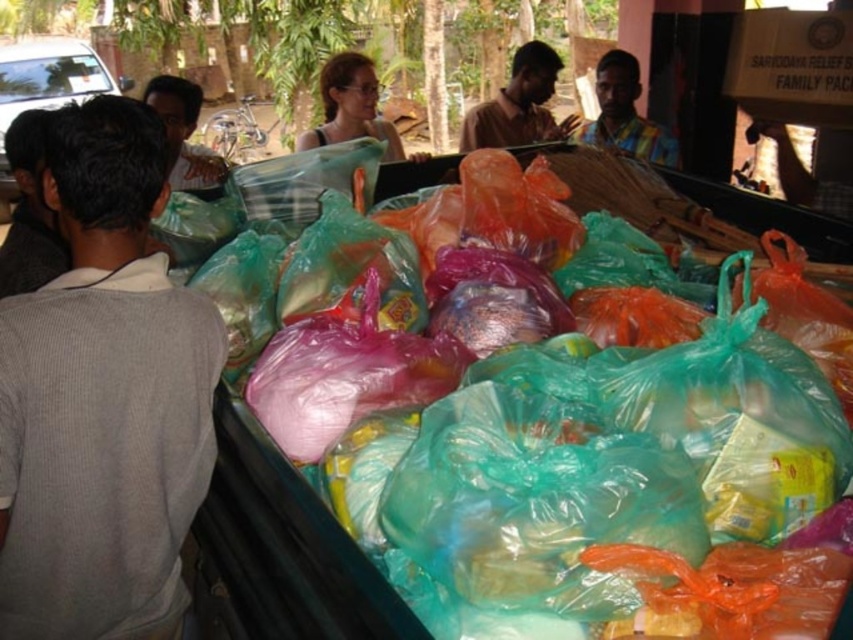
What do you see at coordinates (103, 397) in the screenshot?
I see `gray cotton shirt at left` at bounding box center [103, 397].

Does gray cotton shirt at left lie in front of matte black shirt at upper left?

Yes, it is in front of matte black shirt at upper left.

Measure the distance between point (97, 385) and camera.

1.00 meters

You are a GUI agent. You are given a task and a screenshot of the screen. Output one action in this format:
    pyautogui.click(x=<x>, y=<y>)
    Task: Click on the gray cotton shirt at left
    This screenshot has width=853, height=640.
    Given the screenshot: What is the action you would take?
    pyautogui.click(x=103, y=397)

What do you see at coordinates (519, 104) in the screenshot? This screenshot has height=640, width=853. I see `brown matte shirt at upper center` at bounding box center [519, 104].

Does brown matte shirt at upper center have a lesser width compared to multicolored fabric shirt at center?

Incorrect, brown matte shirt at upper center's width is not less than multicolored fabric shirt at center's.

Is point (517, 138) farther from viewer compared to point (624, 108)?

That is True.

Locate an element on the screen. Image resolution: width=853 pixels, height=640 pixels. brown matte shirt at upper center is located at coordinates (519, 104).

Between translucent plastic bags at center and brown matte shirt at upper center, which one is positioned higher?

brown matte shirt at upper center

Between translucent plastic bags at center and brown matte shirt at upper center, which one appears on the right side from the viewer's perspective?

From the viewer's perspective, translucent plastic bags at center appears more on the right side.

Between point (561, 163) and point (547, 67), which one is positioned behind?

Positioned behind is point (547, 67).

Where is `translucent plastic bags at center`? translucent plastic bags at center is located at coordinates (635, 195).